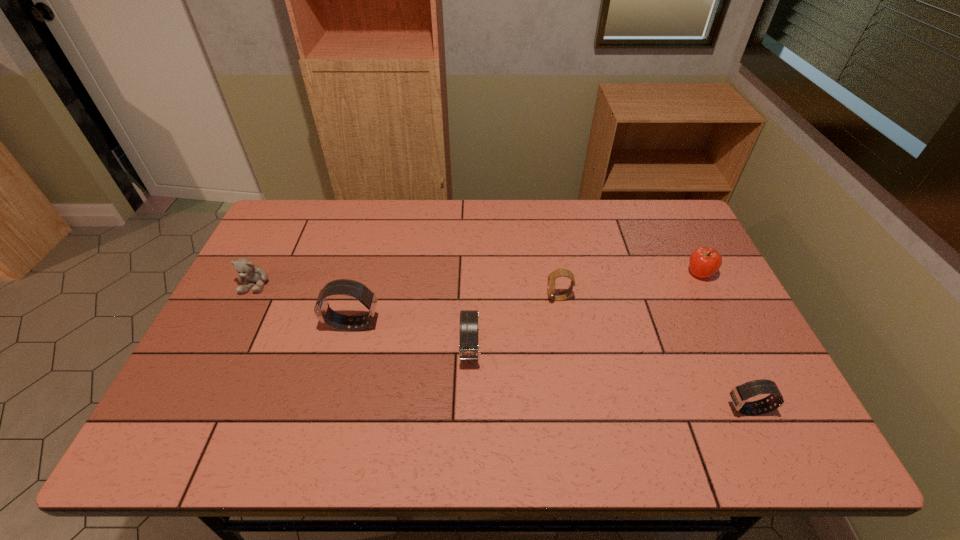
Please point a location where one more watch can be added evenly. Please provide its 2D coordinates. Your answer should be formatted as a tuple, i.e. [(x, y)], where the tuple contains the x and y coordinates of a point satisfying the conditions above.

[(601, 378)]